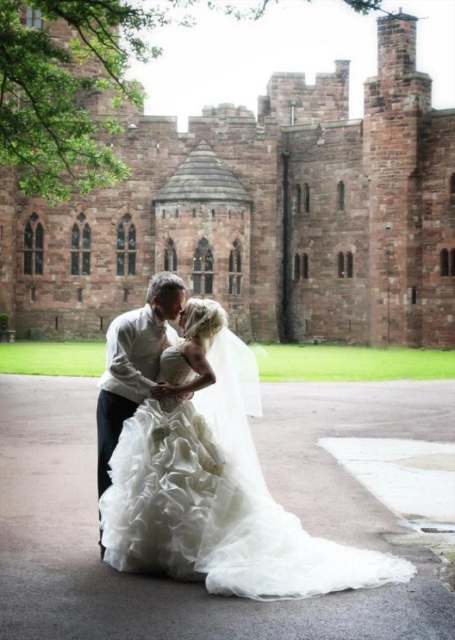
Does reddish-brown stone castle at center have a greater height compared to matte white shirt at center?

Yes, reddish-brown stone castle at center is taller than matte white shirt at center.

Can you confirm if reddish-brown stone castle at center is shorter than matte white shirt at center?

No.

Is point (347, 308) closer to camera compared to point (158, 358)?

No, (347, 308) is behind (158, 358).

At what (x,y) coordinates should I click in order to perform the action: click on reddish-brown stone castle at center. Please return your answer as a coordinate pair (x, y). This screenshot has width=455, height=640. Looking at the image, I should click on (262, 216).

Is white tulle dress at center positioned before matte white shirt at center?

That is True.

Is point (338, 579) farther from camera compared to point (115, 371)?

No, it is not.

Is point (112, 554) positioned after point (136, 355)?

No, (112, 554) is in front of (136, 355).

Locate an element on the screen. white tulle dress at center is located at coordinates (218, 499).

Who is more forward, (431,284) or (107,540)?

Point (107,540) is in front.

Is point (407, 148) closer to viewer compared to point (370, 573)?

No, (407, 148) is behind (370, 573).

Is point (308, 298) farther from viewer compared to point (228, 472)?

Yes.

Identify the location of reddish-brown stone castle at center. The image size is (455, 640). (262, 216).